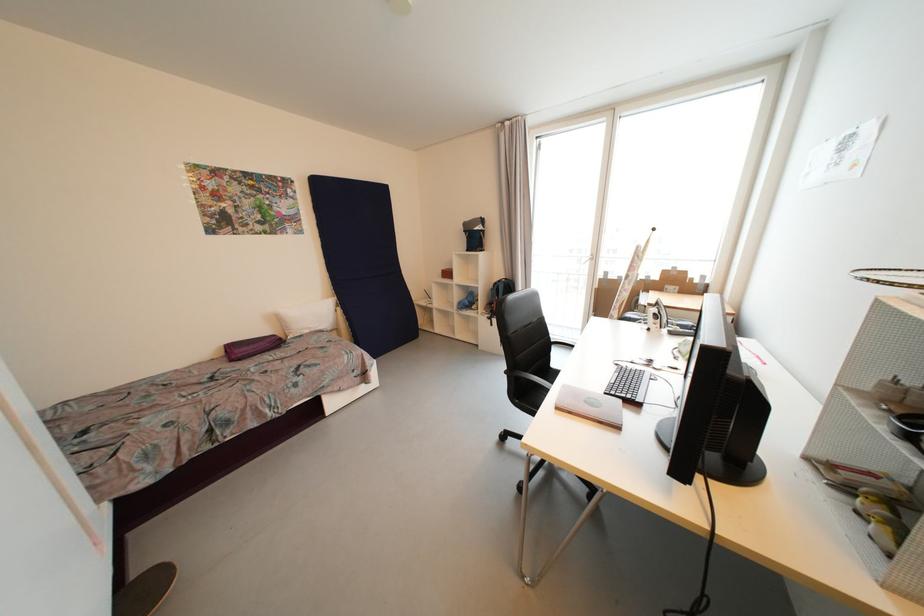
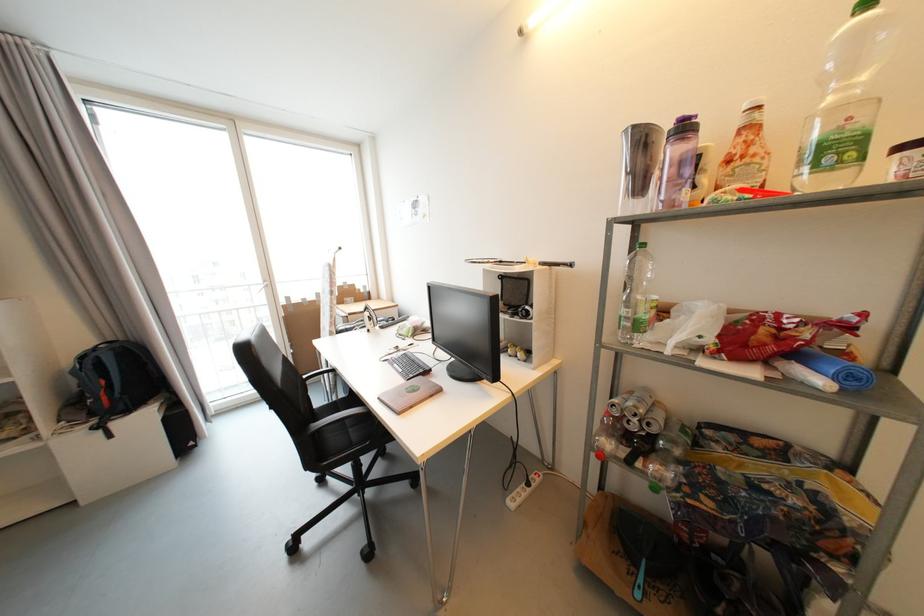
Where in the second image is the point corresponding to point (494, 320) from the first image?

(104, 429)